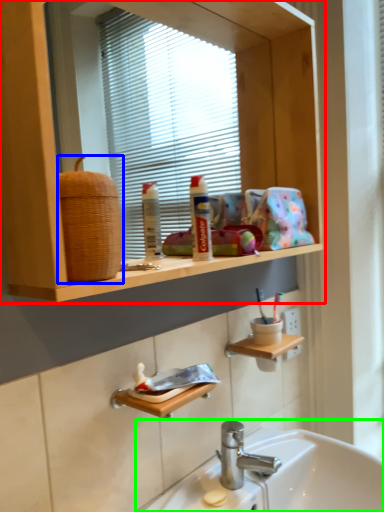
Question: Estimate the real-world distances between objects in this image. Which object is closer to bathroom cabinet (highlighted by a red box), basket (highlighted by a blue box) or sink (highlighted by a green box)?

Choices:
 (A) basket
 (B) sink

Answer: (A)